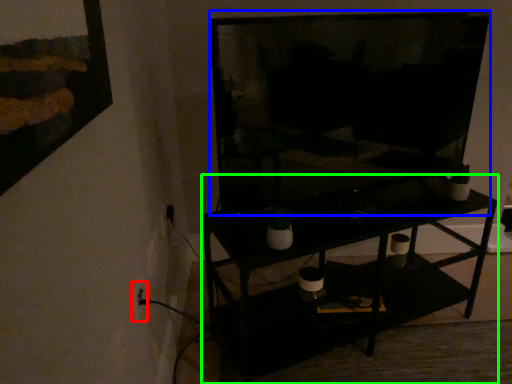
Question: Which object is positioned closest to electric outlet (highlighted by a red box)? Select from television (highlighted by a blue box) and shelf (highlighted by a green box).

Choices:
 (A) television
 (B) shelf

Answer: (B)